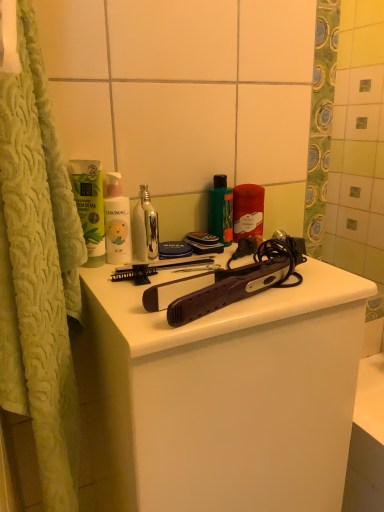
At what (x,y) coordinates should I click in order to perform the action: click on empty space that is ontop of matte black hair straightener at center (from a real-world perspective). Please return your answer as a coordinate pair (x, y). The width and height of the screenshot is (384, 512). Looking at the image, I should click on (206, 275).